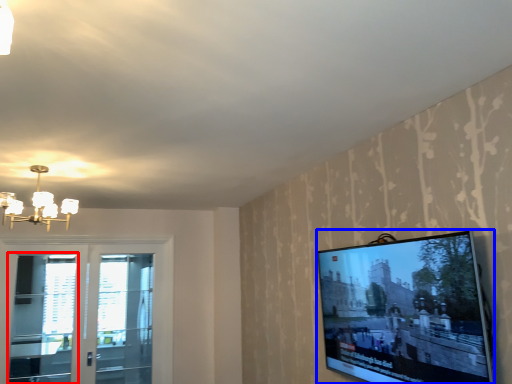
Question: Which object is closer to the camera taking this photo, screen door (highlighted by a red box) or television (highlighted by a blue box)?

Choices:
 (A) screen door
 (B) television

Answer: (B)